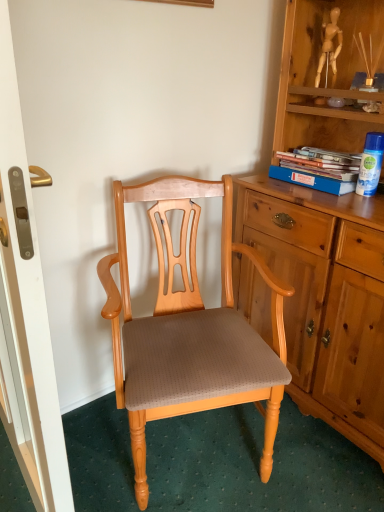
Describe the element at coordinates (370, 164) in the screenshot. I see `blue plastic spray can at upper right` at that location.

This screenshot has width=384, height=512. What do you see at coordinates (192, 336) in the screenshot?
I see `light brown wood chair at center` at bounding box center [192, 336].

Measure the distance between matte wood screen door at left and camera.

A distance of 56.06 centimeters exists between matte wood screen door at left and camera.

In order to face blue cardboard book at upper right, should I rotate leftwards or rightwards?

Rotate right and turn 17.356 degrees.

Where is `blue plastic spray can at upper right`? Image resolution: width=384 pixels, height=512 pixels. blue plastic spray can at upper right is located at coordinates click(370, 164).

Based on their positions, is light brown wood chair at center located to the left or right of blue cardboard book at upper right?

From the image, it's evident that light brown wood chair at center is to the left of blue cardboard book at upper right.

Can you confirm if light brown wood chair at center is taller than blue cardboard book at upper right?

Indeed, light brown wood chair at center has a greater height compared to blue cardboard book at upper right.

Find the location of a particular element. The width and height of the screenshot is (384, 512). chair below the blue cardboard book at upper right (from a real-world perspective) is located at coordinates point(192,336).

How different are the orientations of blue cardboard book at upper right and matte wood screen door at left in degrees?

There is a 1.68-degree angle between the facing directions of blue cardboard book at upper right and matte wood screen door at left.

Is point (353, 170) less distant than point (36, 448)?

No.

Is blue cardboard book at upper right taller or shorter than matte wood screen door at left?

blue cardboard book at upper right is shorter than matte wood screen door at left.

From the image's perspective, which object appears higher, blue cardboard book at upper right or matte wood screen door at left?

blue cardboard book at upper right is shown above in the image.

Is blue plastic spray can at upper right positioned far away from light brown wood chair at center?

blue plastic spray can at upper right is near light brown wood chair at center, not far away.

Can you confirm if blue plastic spray can at upper right is thinner than light brown wood chair at center?

Indeed, blue plastic spray can at upper right has a lesser width compared to light brown wood chair at center.

Between blue plastic spray can at upper right and light brown wood chair at center, which one has less height?

With less height is blue plastic spray can at upper right.

Does matte wood screen door at left have a lesser height compared to light brown wood chair at center?

Incorrect, the height of matte wood screen door at left does not fall short of that of light brown wood chair at center.

Considering the positions of objects matte wood screen door at left and light brown wood chair at center in the image provided, who is more to the left, matte wood screen door at left or light brown wood chair at center?

matte wood screen door at left is more to the left.

Is matte wood screen door at left facing towards light brown wood chair at center?

Yes.

At what (x,y) coordinates should I click in order to perform the action: click on chair lying on the right of matte wood screen door at left. Please return your answer as a coordinate pair (x, y). Looking at the image, I should click on (192, 336).

From the image's perspective, is blue plastic spray can at upper right under blue cardboard book at upper right?

Yes.

From a real-world perspective, is blue plastic spray can at upper right positioned over blue cardboard book at upper right based on gravity?

Yes.

Considering the relative sizes of blue plastic spray can at upper right and blue cardboard book at upper right in the image provided, is blue plastic spray can at upper right bigger than blue cardboard book at upper right?

No, blue plastic spray can at upper right is not bigger than blue cardboard book at upper right.

Would you say blue cardboard book at upper right is to the left or to the right of light brown wood chair at center in the picture?

blue cardboard book at upper right is positioned on light brown wood chair at center's right side.

Locate an element on the screen. Image resolution: width=384 pixels, height=512 pixels. book that is behind the light brown wood chair at center is located at coordinates (318, 169).

Which is further, [306,153] or [194,324]?

The point [306,153] is more distant.

Considering the positions of objects light brown wood chair at center and matte wood screen door at left in the image provided, who is in front, light brown wood chair at center or matte wood screen door at left?

Positioned in front is matte wood screen door at left.

Is the surface of light brown wood chair at center in direct contact with matte wood screen door at left?

No, light brown wood chair at center is not next to matte wood screen door at left.

Can you tell me how much light brown wood chair at center and matte wood screen door at left differ in facing direction?

The facing directions of light brown wood chair at center and matte wood screen door at left are 70.1 degrees apart.

Which of these two, light brown wood chair at center or matte wood screen door at left, is smaller?

With smaller size is matte wood screen door at left.

At what (x,y) coordinates should I click in order to perform the action: click on book lying behind the light brown wood chair at center. Please return your answer as a coordinate pair (x, y). Looking at the image, I should click on (318, 169).

What are the coordinates of `book on the right side of matte wood screen door at left` in the screenshot? It's located at (318, 169).

From the image, which object appears to be farther from blue plastic spray can at upper right, light brown wood chair at center or matte wood screen door at left?

matte wood screen door at left.

Based on their spatial positions, is matte wood screen door at left or blue cardboard book at upper right closer to light brown wood chair at center?

matte wood screen door at left.

Which object lies further to the anchor point matte wood screen door at left, blue plastic spray can at upper right or blue cardboard book at upper right?

blue plastic spray can at upper right lies further to matte wood screen door at left than the other object.

From the image, which object appears to be nearer to matte wood screen door at left, light brown wood chair at center or blue cardboard book at upper right?

light brown wood chair at center lies closer to matte wood screen door at left than the other object.

From the image, which object appears to be farther from blue plastic spray can at upper right, matte wood screen door at left or blue cardboard book at upper right?

The object further to blue plastic spray can at upper right is matte wood screen door at left.

Considering their positions, is light brown wood chair at center positioned further to matte wood screen door at left than blue plastic spray can at upper right?

The object further to matte wood screen door at left is blue plastic spray can at upper right.

Looking at the image, which one is located closer to blue cardboard book at upper right, blue plastic spray can at upper right or light brown wood chair at center?

blue plastic spray can at upper right is closer to blue cardboard book at upper right.

Which object lies nearer to the anchor point blue plastic spray can at upper right, light brown wood chair at center or blue cardboard book at upper right?

Based on the image, blue cardboard book at upper right appears to be nearer to blue plastic spray can at upper right.

I want to click on chair between matte wood screen door at left and blue plastic spray can at upper right from left to right, so click(192, 336).

What are the coordinates of `chair located between matte wood screen door at left and blue cardboard book at upper right in the left-right direction` in the screenshot? It's located at (192, 336).

Identify the location of toy between light brown wood chair at center and blue cardboard book at upper right from front to back. This screenshot has height=512, width=384. (370, 164).

I want to click on book situated between matte wood screen door at left and blue plastic spray can at upper right from left to right, so click(x=318, y=169).